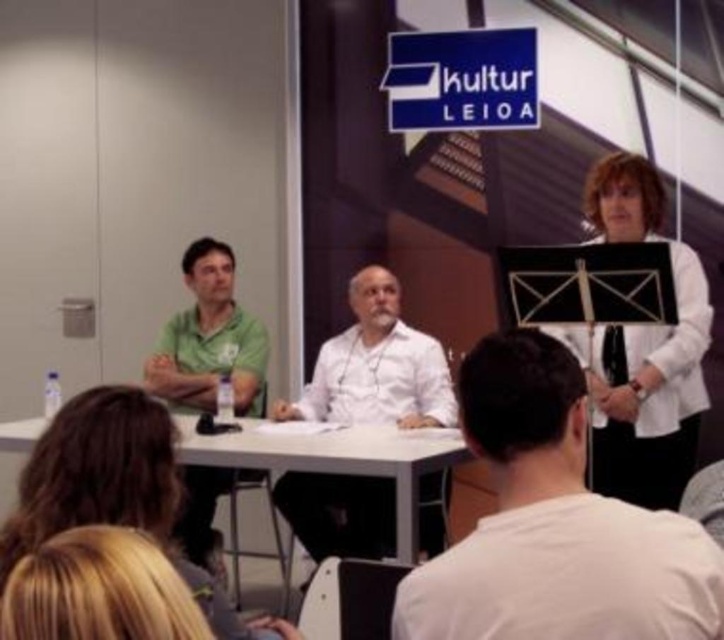
Based on the coordinates provided, which object is located at point [376,365] in the scene?

The point [376,365] marks the location of the white matte shirt at center.

You are an attendee at the Kultur Leioa event and want to take a photo of the speaker wearing the white cotton shirt at center. Where should you position yourself to capture the speaker in the frame?

To capture the speaker wearing the white cotton shirt at center in your photo, position yourself facing the stage area, aligning your camera with the coordinates point at approximately 0.820 on the horizontal axis and 0.767 on the vertical axis, as that is where the white cotton shirt at center is located.